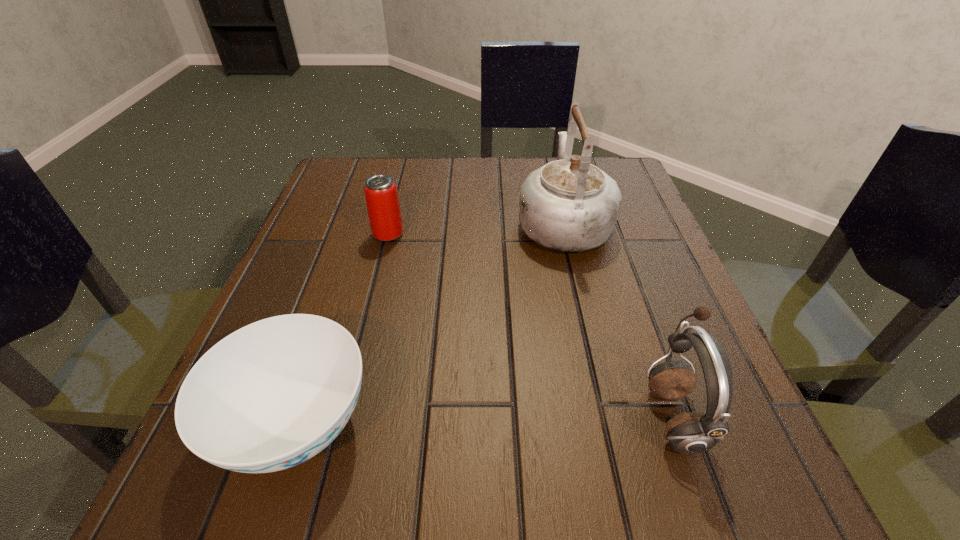
Find the location of a particular element. free space located on the front of the beer can is located at coordinates (376, 282).

Where is `vacant space located on the right of the chinaware`? Image resolution: width=960 pixels, height=540 pixels. vacant space located on the right of the chinaware is located at coordinates (654, 425).

The width and height of the screenshot is (960, 540). I want to click on object present at the far edge, so click(569, 205).

Where is `earphone that is at the near edge`? earphone that is at the near edge is located at coordinates (692, 432).

What are the coordinates of `chinaware that is at the near edge` in the screenshot? It's located at (271, 395).

Identify the location of beer can present at the left edge. (381, 195).

Find the location of a particular element. chinaware located at the left edge is located at coordinates (271, 395).

Identify the location of kettle positioned at the right edge. This screenshot has height=540, width=960. (569, 205).

Image resolution: width=960 pixels, height=540 pixels. Find the location of `earphone that is at the right edge`. earphone that is at the right edge is located at coordinates (692, 432).

Locate an element on the screen. object at the near left corner is located at coordinates (271, 395).